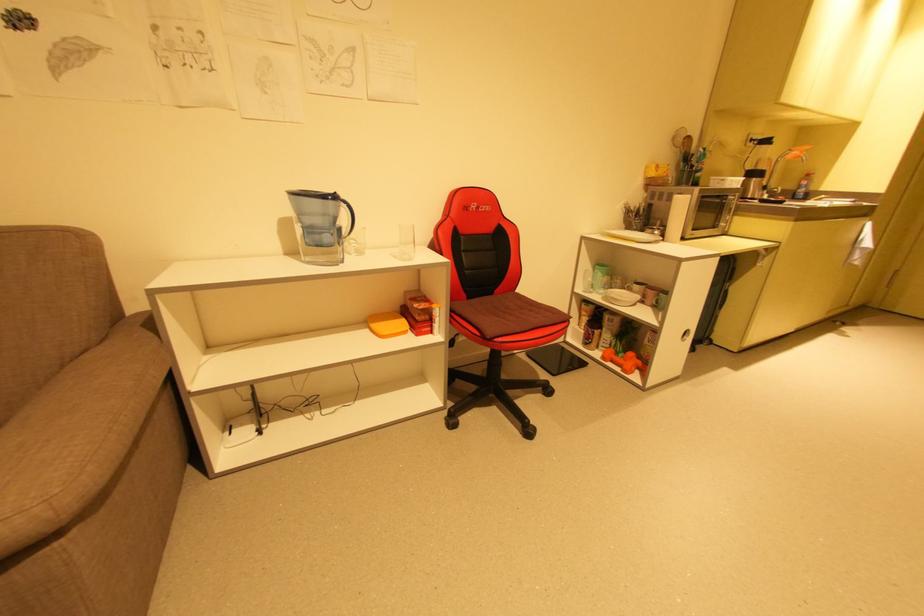
Where would you lift the electric kettle handle? Please return your answer as a coordinate pair (x, y).

(320, 225)